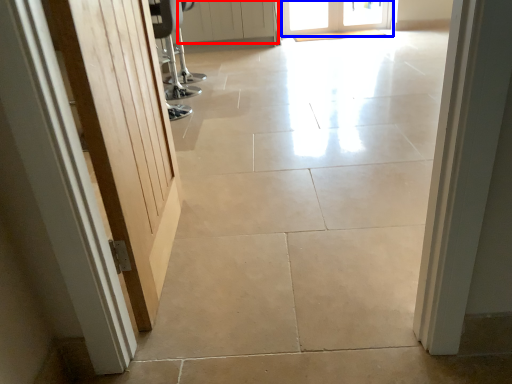
Question: Among these objects, which one is nearest to the camera, door (highlighted by a red box) or door (highlighted by a blue box)?

Choices:
 (A) door
 (B) door

Answer: (A)